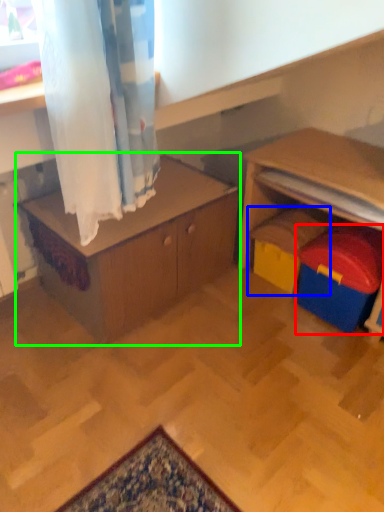
Question: Estimate the real-world distances between objects in this image. Which object is farther from toy (highlighted by a red box), toy (highlighted by a blue box) or table (highlighted by a green box)?

Choices:
 (A) toy
 (B) table

Answer: (B)